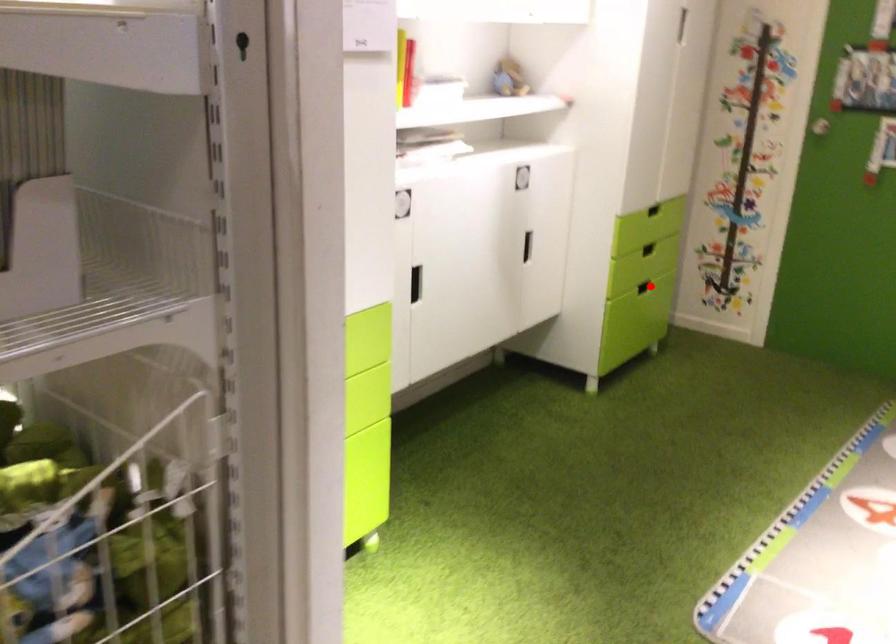
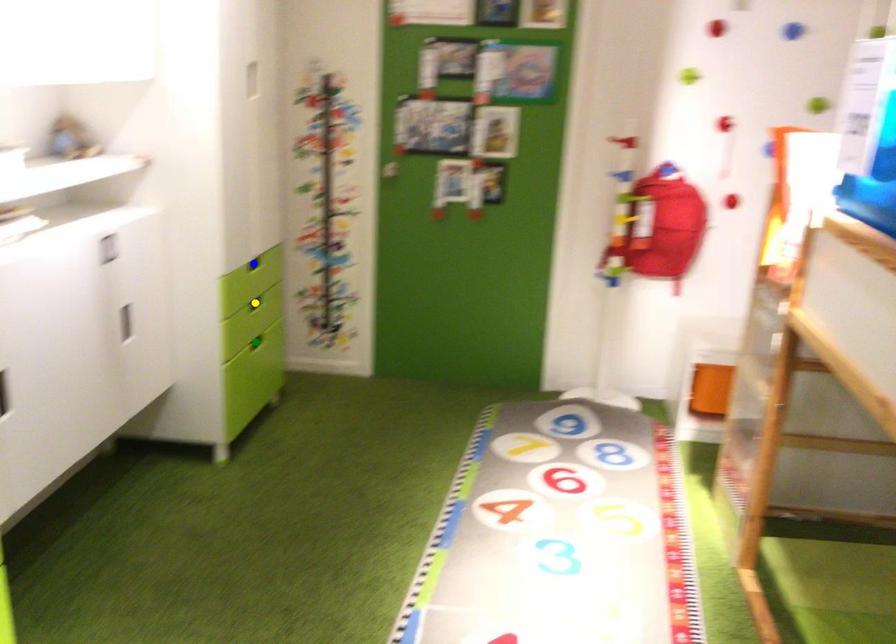
Question: I am providing you with two images of the same scene from different viewpoints. A red point is marked on the first image. You are given multiple points on the second image. Which point in image 2 is actually the same real-world point as the red point in image 1?

Choices:
 (A) green point
 (B) blue point
 (C) yellow point

Answer: (A)